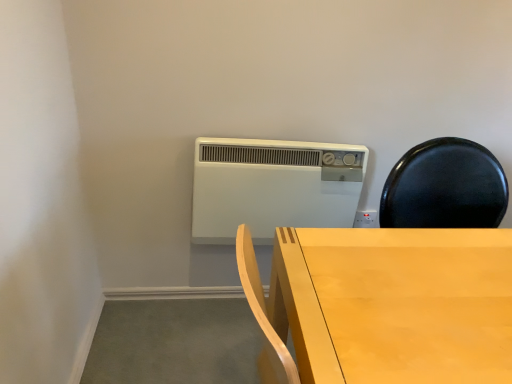
Question: Can you confirm if white plastic heater at upper center is thinner than light wood table at center?

Choices:
 (A) no
 (B) yes

Answer: (B)

Question: From the image's perspective, is white plastic heater at upper center on top of light wood table at center?

Choices:
 (A) no
 (B) yes

Answer: (B)

Question: Are white plastic heater at upper center and light wood table at center far apart?

Choices:
 (A) no
 (B) yes

Answer: (A)

Question: Considering the relative sizes of white plastic heater at upper center and light wood table at center in the image provided, is white plastic heater at upper center smaller than light wood table at center?

Choices:
 (A) yes
 (B) no

Answer: (A)

Question: Considering the relative positions of white plastic heater at upper center and light wood table at center in the image provided, is white plastic heater at upper center behind light wood table at center?

Choices:
 (A) no
 (B) yes

Answer: (B)

Question: Is white plastic heater at upper center outside of light wood table at center?

Choices:
 (A) yes
 (B) no

Answer: (A)

Question: Considering the relative sizes of light wood table at center and white plastic heater at upper center in the image provided, is light wood table at center thinner than white plastic heater at upper center?

Choices:
 (A) yes
 (B) no

Answer: (B)

Question: Is light wood table at center next to white plastic heater at upper center and touching it?

Choices:
 (A) yes
 (B) no

Answer: (B)

Question: From a real-world perspective, is light wood table at center located beneath white plastic heater at upper center?

Choices:
 (A) yes
 (B) no

Answer: (B)

Question: Considering the relative sizes of light wood table at center and white plastic heater at upper center in the image provided, is light wood table at center wider than white plastic heater at upper center?

Choices:
 (A) yes
 (B) no

Answer: (A)

Question: Is light wood table at center positioned before white plastic heater at upper center?

Choices:
 (A) yes
 (B) no

Answer: (A)

Question: Does light wood table at center lie behind white plastic heater at upper center?

Choices:
 (A) yes
 (B) no

Answer: (B)

Question: Considering the positions of point (322, 369) and point (352, 178), is point (322, 369) closer or farther from the camera than point (352, 178)?

Choices:
 (A) closer
 (B) farther

Answer: (A)